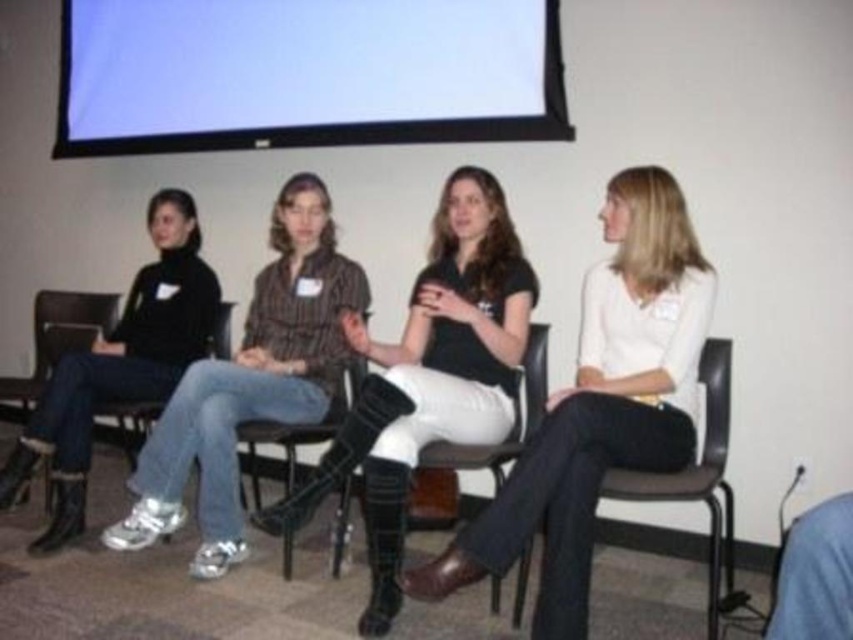
What is located at the coordinates point (428, 376)?

Black leather boots at center are located at point (428, 376).

Based on the scene description, can you determine which object is shorter between the white matte projection screen at upper center and the matte black shirt at center?

The white matte projection screen at upper center has a lesser height compared to the matte black shirt at center, so the white matte projection screen at upper center is shorter.